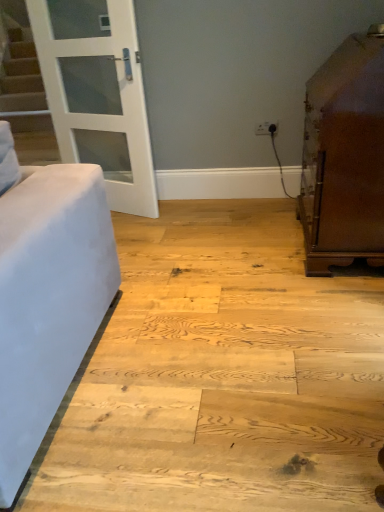
This screenshot has width=384, height=512. Identify the location of vacant position to the left of brown polished cabinet at right. (237, 261).